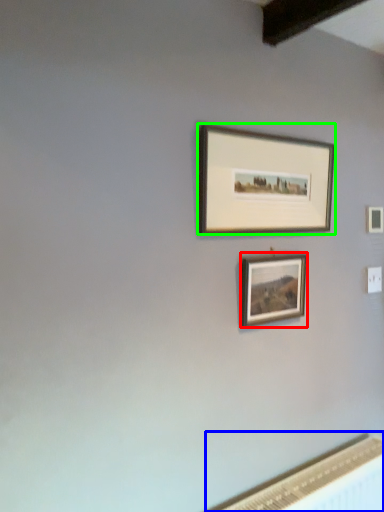
Question: Estimate the real-world distances between objects in this image. Which object is farther from picture frame (highlighted by a red box), radiator (highlighted by a blue box) or picture frame (highlighted by a green box)?

Choices:
 (A) radiator
 (B) picture frame

Answer: (A)